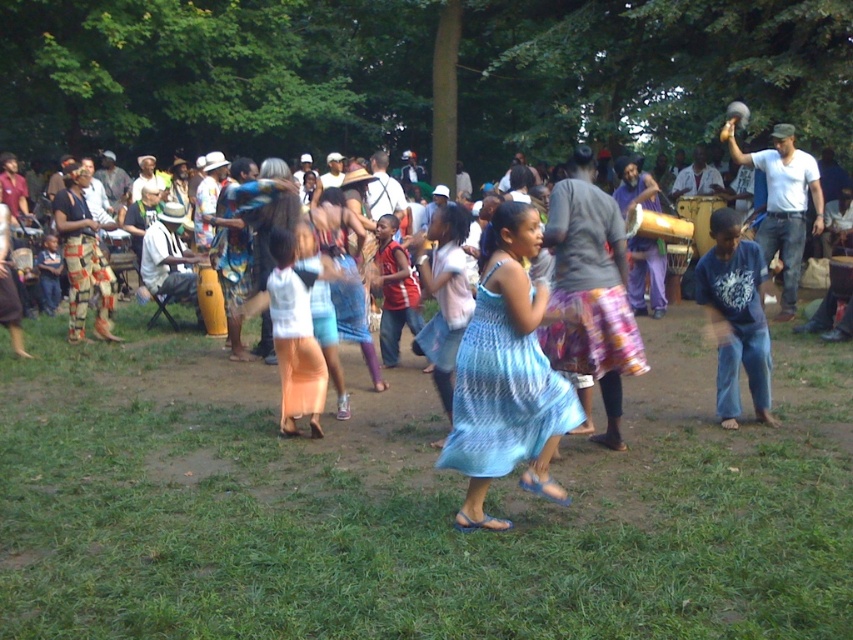
Question: Can you confirm if blue knitted dress at center is wider than light orange fabric skirt at center?

Choices:
 (A) yes
 (B) no

Answer: (A)

Question: Which of the following is the closest to the observer?

Choices:
 (A) (274, 291)
 (B) (506, 406)
 (C) (28, 602)

Answer: (C)

Question: Estimate the real-world distances between objects in this image. Which object is farther from the green grass at center?

Choices:
 (A) light orange fabric skirt at center
 (B) blue knitted dress at center

Answer: (A)

Question: Where is green grass at center located in relation to blue knitted dress at center in the image?

Choices:
 (A) right
 (B) left

Answer: (A)

Question: Estimate the real-world distances between objects in this image. Which object is farther from the light orange fabric skirt at center?

Choices:
 (A) blue knitted dress at center
 (B) green grass at center

Answer: (B)

Question: Can you confirm if blue knitted dress at center is positioned above light orange fabric skirt at center?

Choices:
 (A) yes
 (B) no

Answer: (B)